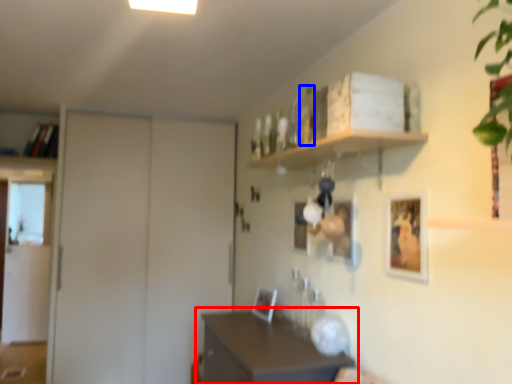
Question: Which object is further to the camera taking this photo, table (highlighted by a red box) or bottle (highlighted by a blue box)?

Choices:
 (A) table
 (B) bottle

Answer: (B)